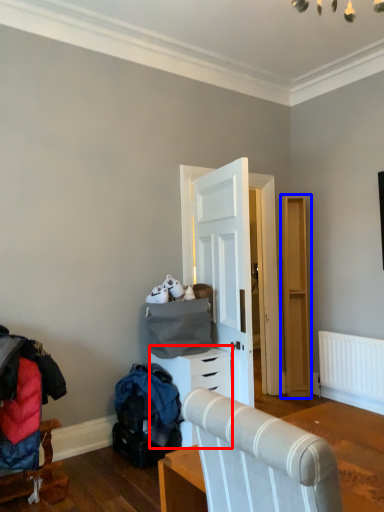
Question: Which of the following is the farthest to the observer, chest of drawers (highlighted by a red box) or dresser (highlighted by a blue box)?

Choices:
 (A) chest of drawers
 (B) dresser

Answer: (B)